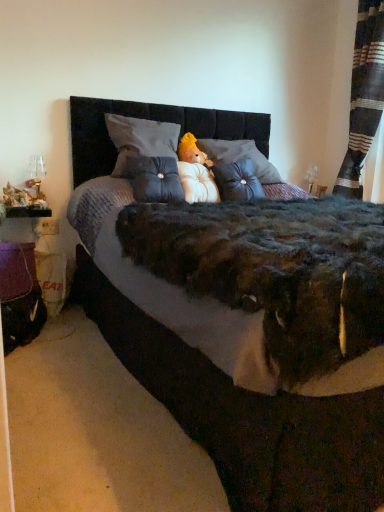
Question: Is tufted fabric pillow at center, the second throw pillow viewed from the right, shorter than velvet gray throw pillow at center, the 2th throw pillow viewed from the left?

Choices:
 (A) yes
 (B) no

Answer: (A)

Question: Is tufted fabric pillow at center, which appears as the first throw pillow when viewed from the left, at the left side of velvet gray throw pillow at center, the first throw pillow from the right?

Choices:
 (A) yes
 (B) no

Answer: (A)

Question: Is tufted fabric pillow at center, the second throw pillow viewed from the right, positioned far away from velvet gray throw pillow at center, the 2th throw pillow viewed from the left?

Choices:
 (A) no
 (B) yes

Answer: (A)

Question: Is tufted fabric pillow at center, the second throw pillow viewed from the right, facing away from velvet gray throw pillow at center, the first throw pillow from the right?

Choices:
 (A) no
 (B) yes

Answer: (A)

Question: From a real-world perspective, is tufted fabric pillow at center, the second throw pillow viewed from the right, on velvet gray throw pillow at center, the first throw pillow from the right?

Choices:
 (A) no
 (B) yes

Answer: (B)

Question: Considering the positions of point (375, 73) and point (230, 421), is point (375, 73) closer or farther from the camera than point (230, 421)?

Choices:
 (A) farther
 (B) closer

Answer: (A)

Question: Is striped fabric curtain at right inside the boundaries of velvet black bed at center, or outside?

Choices:
 (A) outside
 (B) inside

Answer: (A)

Question: In the image, is striped fabric curtain at right on the left side or the right side of velvet black bed at center?

Choices:
 (A) left
 (B) right

Answer: (B)

Question: Is striped fabric curtain at right taller or shorter than velvet black bed at center?

Choices:
 (A) short
 (B) tall

Answer: (B)

Question: In terms of height, does velvet black bed at center look taller or shorter compared to purple fabric table at lower left?

Choices:
 (A) short
 (B) tall

Answer: (B)

Question: Is velvet black bed at center spatially inside purple fabric table at lower left, or outside of it?

Choices:
 (A) outside
 (B) inside

Answer: (A)

Question: Looking at the image, does velvet black bed at center seem bigger or smaller compared to purple fabric table at lower left?

Choices:
 (A) big
 (B) small

Answer: (A)

Question: Is point coord(213,368) positioned closer to the camera than point coord(31,262)?

Choices:
 (A) farther
 (B) closer

Answer: (B)

Question: Choose the correct answer: Is velvet black bed at center inside fluffy white teddy bear at center or outside it?

Choices:
 (A) outside
 (B) inside

Answer: (A)

Question: Looking at the image, does velvet black bed at center seem bigger or smaller compared to fluffy white teddy bear at center?

Choices:
 (A) small
 (B) big

Answer: (B)